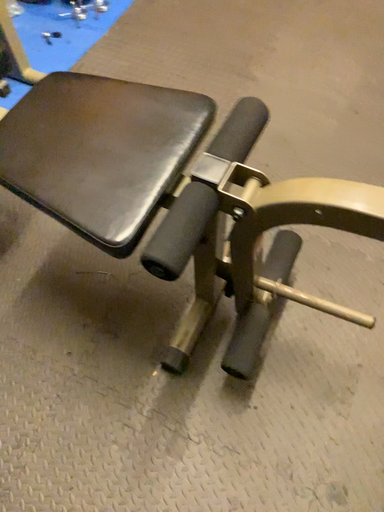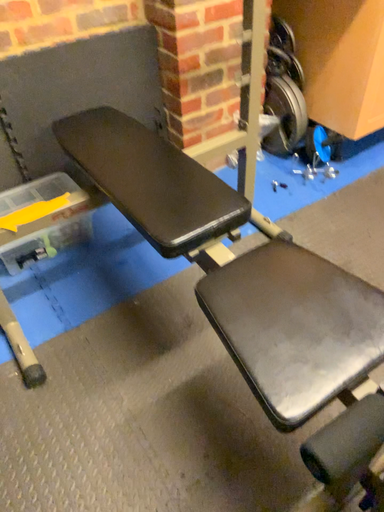
Question: Which way did the camera rotate in the video?

Choices:
 (A) rotated left
 (B) rotated right

Answer: (A)